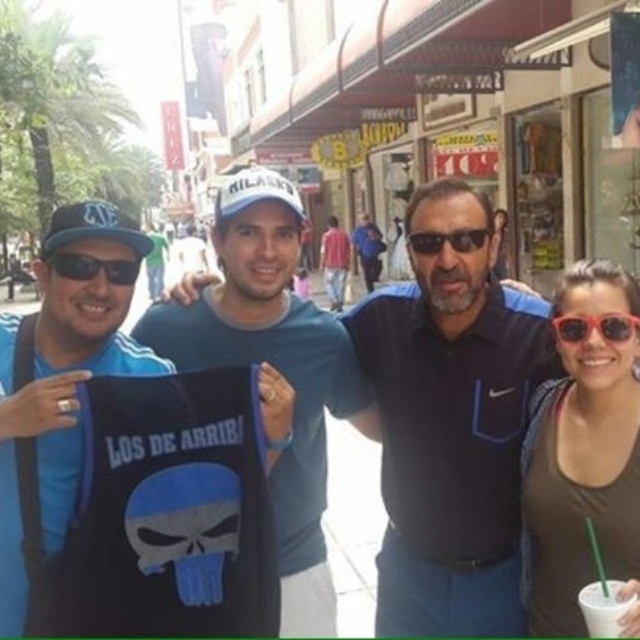
You are taking a photo of two points in the scene. The first point is at coordinates point (609, 593) and the second is at point (77, 259). Which point is closer to the camera?

Point (609, 593) is closer to the camera than point (77, 259).

You are a photographer trying to capture a closeup shot of the black plastic sunglasses at left without including the white paper cup at lower right in the frame. Given their positions, is this possible?

The white paper cup at lower right is below the black plastic sunglasses at left, so adjusting the camera angle upwards to focus on the black plastic sunglasses at left while avoiding the lower area where the white paper cup at lower right is located should allow you to exclude it from the frame.